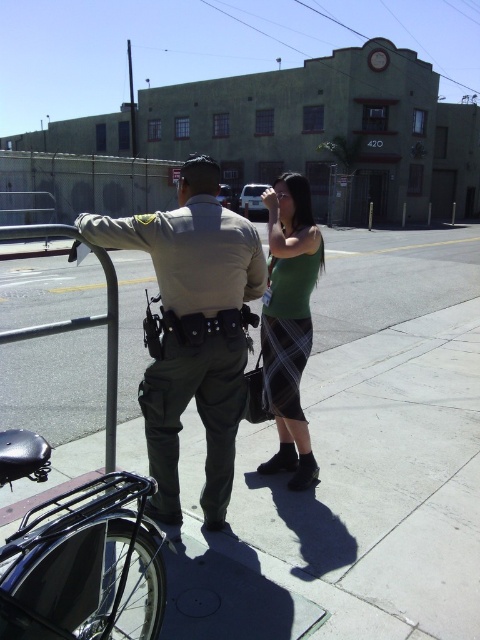
Question: Estimate the real-world distances between objects in this image. Which object is closer to the matte khaki uniform at center?

Choices:
 (A) green plaid skirt at center
 (B) gray concrete sidewalk at center

Answer: (A)

Question: Estimate the real-world distances between objects in this image. Which object is farther from the matte khaki uniform at center?

Choices:
 (A) green plaid skirt at center
 (B) gray concrete sidewalk at center

Answer: (B)

Question: Can you confirm if gray concrete sidewalk at center is wider than green plaid skirt at center?

Choices:
 (A) yes
 (B) no

Answer: (A)

Question: Which of the following is the farthest from the observer?

Choices:
 (A) (304, 557)
 (B) (286, 172)
 (C) (132, 248)

Answer: (B)

Question: Is gray concrete sidewalk at center to the left of matte khaki uniform at center from the viewer's perspective?

Choices:
 (A) yes
 (B) no

Answer: (A)

Question: Can you confirm if gray concrete sidewalk at center is bigger than green plaid skirt at center?

Choices:
 (A) no
 (B) yes

Answer: (B)